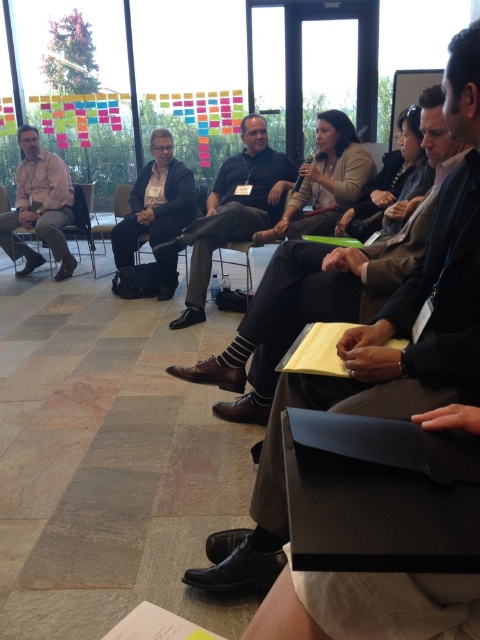
Is dark brown leather shoes at center above matte pink shirt at left?

No, dark brown leather shoes at center is not above matte pink shirt at left.

The width and height of the screenshot is (480, 640). In order to click on dark brown leather shoes at center in this screenshot , I will do `click(322, 288)`.

Is matte black suit at center to the right of matte pink shirt at left from the viewer's perspective?

Indeed, matte black suit at center is positioned on the right side of matte pink shirt at left.

Does point (160, 292) come closer to viewer compared to point (49, 157)?

Yes.

Is point (175, 276) positioned before point (36, 196)?

That is True.

This screenshot has height=640, width=480. I want to click on matte black suit at center, so click(x=155, y=202).

Who is more forward, (x=342, y=314) or (x=243, y=173)?

Point (x=342, y=314) is in front.

This screenshot has width=480, height=640. I want to click on dark brown leather shoes at center, so click(322, 288).